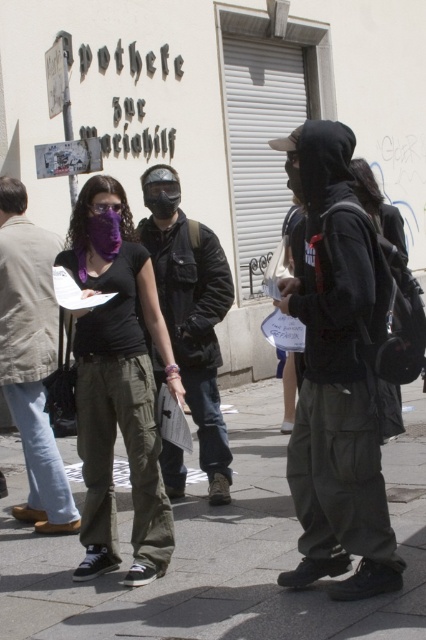
You are part of a protest and need to quickly identify the protective gear available. Which object is positioned lower in the scene between the matte black helmet at center and the purple matte goggles at center?

The matte black helmet at center is located below the purple matte goggles at center, so the helmet is positioned lower in the scene.

You are a photographer trying to capture a clear shot of both the matte black helmet at center and the purple matte goggles at center. Based on their sizes, which object should you focus on first to ensure it fits within your camera frame?

The matte black helmet at center might be wider than the purple matte goggles at center, so you should focus on capturing the matte black helmet at center first to ensure it fits within the frame.